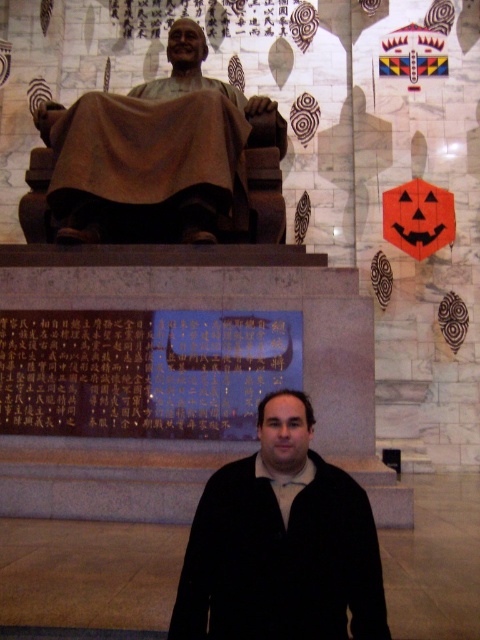
Question: Which object is closer to the camera taking this photo?

Choices:
 (A) bronze statue at center
 (B) black matte jacket at center

Answer: (B)

Question: Which point appears farthest from the camera in this image?

Choices:
 (A) (176, 134)
 (B) (215, 634)

Answer: (A)

Question: Can you confirm if black matte jacket at center is wider than bronze statue at center?

Choices:
 (A) no
 (B) yes

Answer: (A)

Question: Where is black matte jacket at center located in relation to bronze statue at center in the image?

Choices:
 (A) above
 (B) below

Answer: (B)

Question: Does black matte jacket at center appear over bronze statue at center?

Choices:
 (A) yes
 (B) no

Answer: (B)

Question: Which point appears closest to the camera in this image?

Choices:
 (A) (230, 156)
 (B) (194, 600)

Answer: (B)